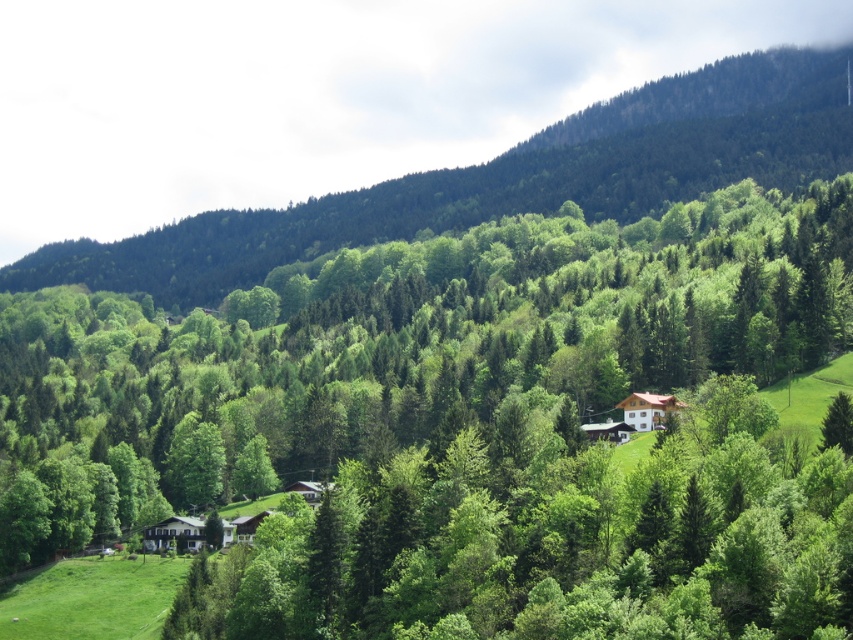
You are standing at the point marked as point [509,179] in the image. Based on the scene description, what type of terrain are you currently standing on?

The point [509,179] is on a green forested mountain at upper center, so you are standing on a mountain covered with dense green forest.